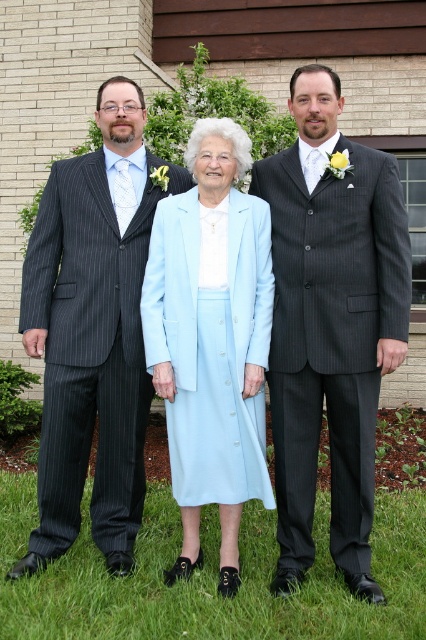
Question: Which object is positioned farthest from the light blue fabric dress at center?

Choices:
 (A) green grass at lower center
 (B) dark gray pinstripe suit at center

Answer: (A)

Question: Which point is farther to the camera?

Choices:
 (A) striped pinstripe suit at left
 (B) light blue fabric dress at center
 (C) green grass at lower center
 (D) dark gray pinstripe suit at center

Answer: (A)

Question: Can you confirm if striped pinstripe suit at left is positioned to the left of green grass at lower center?

Choices:
 (A) yes
 (B) no

Answer: (A)

Question: Which point is closer to the camera?

Choices:
 (A) (129, 477)
 (B) (284, 432)

Answer: (B)

Question: Can you confirm if striped pinstripe suit at left is positioned above light blue fabric dress at center?

Choices:
 (A) no
 (B) yes

Answer: (B)

Question: Where is dark gray pinstripe suit at center located in relation to green grass at lower center in the image?

Choices:
 (A) above
 (B) below

Answer: (A)